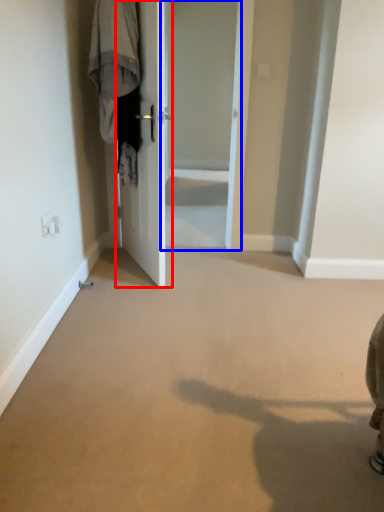
Question: Among these objects, which one is nearest to the camera, door (highlighted by a red box) or screen door (highlighted by a blue box)?

Choices:
 (A) door
 (B) screen door

Answer: (A)